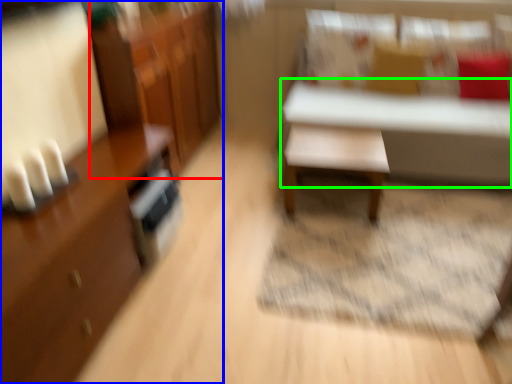
Question: Based on their relative distances, which object is nearer to dresser (highlighted by a red box)? Choose from cabinetry (highlighted by a blue box) and table (highlighted by a green box).

Choices:
 (A) cabinetry
 (B) table

Answer: (A)